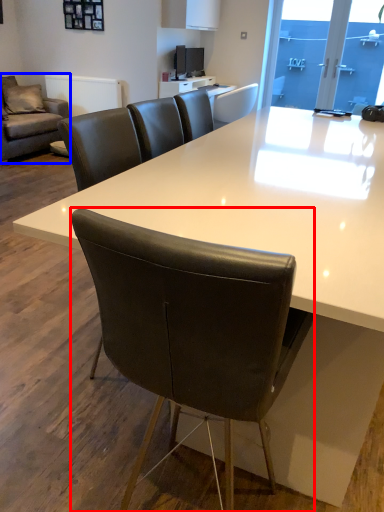
Question: Which of the following is the closest to the observer, chair (highlighted by a red box) or studio couch (highlighted by a blue box)?

Choices:
 (A) chair
 (B) studio couch

Answer: (A)